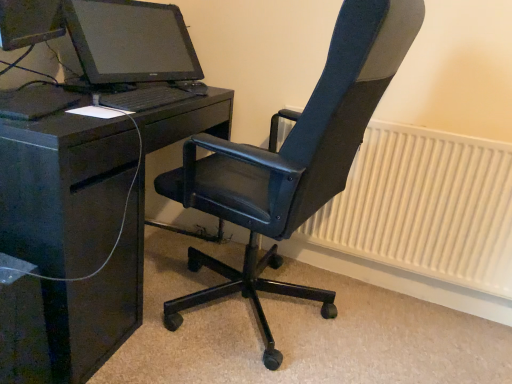
Where is `vacant space that is to the left of white textured radiator at right`? The width and height of the screenshot is (512, 384). vacant space that is to the left of white textured radiator at right is located at coordinates (244, 296).